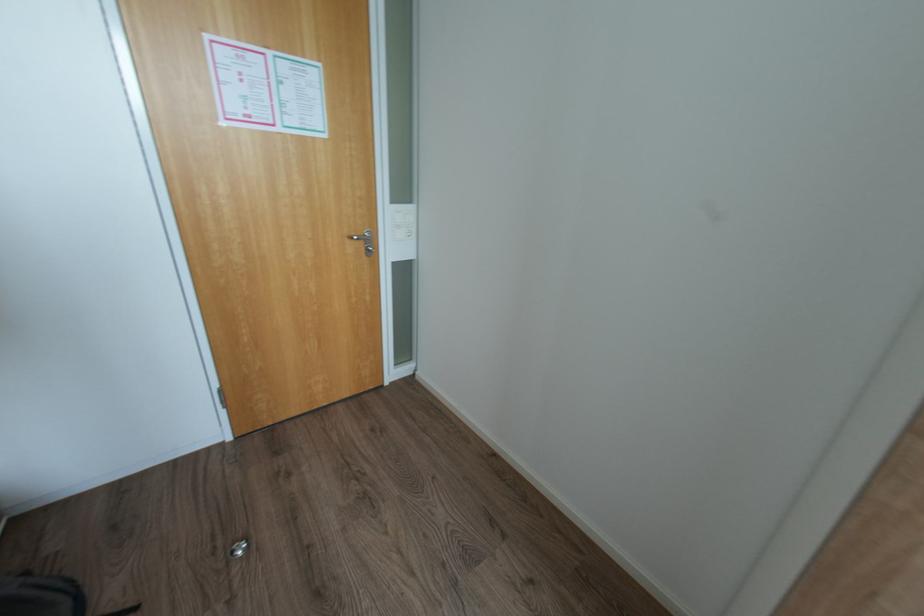
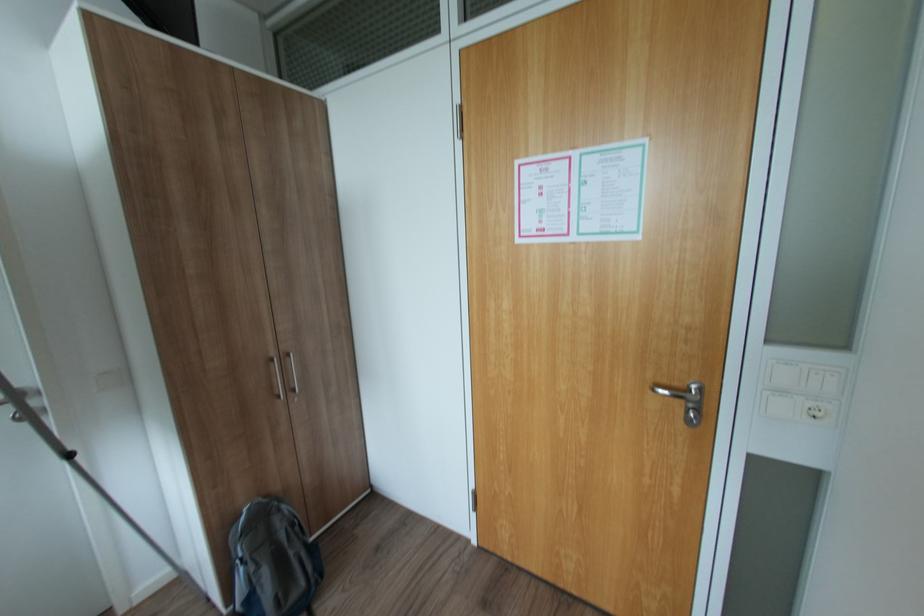
The point at (415, 233) is marked in the first image. Where is the corresponding point in the second image?

(820, 414)